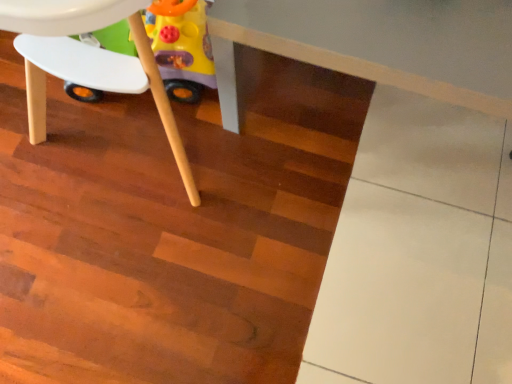
The height and width of the screenshot is (384, 512). What do you see at coordinates (87, 60) in the screenshot? I see `wooden toy car at center` at bounding box center [87, 60].

You are a GUI agent. You are given a task and a screenshot of the screen. Output one action in this format:
    pyautogui.click(x=<x>, y=<y>)
    Task: Click on the wooden toy car at center
    This screenshot has height=384, width=512.
    Given the screenshot: What is the action you would take?
    pyautogui.click(x=87, y=60)

The image size is (512, 384). What are the coordinates of `wooden toy car at center` in the screenshot? It's located at 87,60.